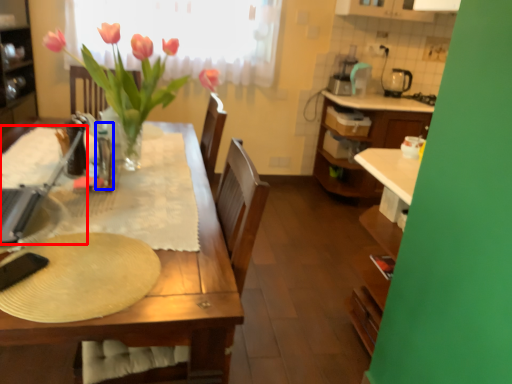
Question: Which object appears farthest to the camera in this image, appliance (highlighted by a red box) or bottle (highlighted by a blue box)?

Choices:
 (A) appliance
 (B) bottle

Answer: (B)